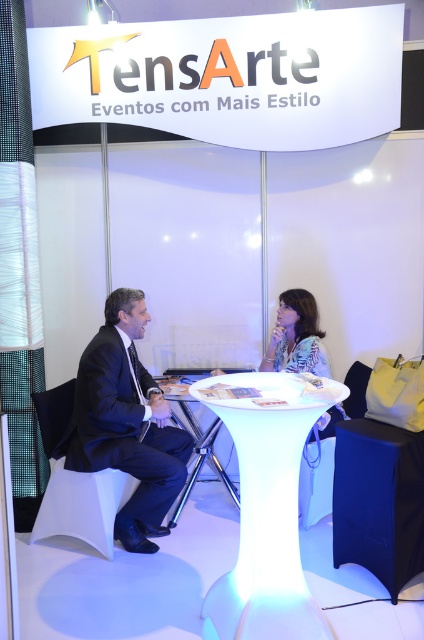
Measure the distance from white glossy table at center to printed fabric blouse at center.

white glossy table at center is 1.13 meters from printed fabric blouse at center.

Can you confirm if white glossy table at center is positioned below printed fabric blouse at center?

Yes.

Does point (267, 444) come farther from viewer compared to point (315, 365)?

No, it is in front of (315, 365).

Where is `white glossy table at center`? Image resolution: width=424 pixels, height=640 pixels. white glossy table at center is located at coordinates coord(265,515).

Does black suit at left have a greater width compared to printed fabric blouse at center?

Indeed, black suit at left has a greater width compared to printed fabric blouse at center.

Who is more forward, (175, 477) or (318, 365)?

Point (175, 477) is more forward.

The height and width of the screenshot is (640, 424). I want to click on black suit at left, so click(127, 422).

At what (x,y) coordinates should I click in order to perform the action: click on black suit at left. Please return your answer as a coordinate pair (x, y). The height and width of the screenshot is (640, 424). Looking at the image, I should click on (127, 422).

Is white glossy table at center to the left of black suit at left from the viewer's perspective?

Incorrect, white glossy table at center is not on the left side of black suit at left.

Describe the element at coordinates (265, 515) in the screenshot. I see `white glossy table at center` at that location.

Is point (214, 376) positioned behind point (130, 531)?

No, it is in front of (130, 531).

You are a GUI agent. You are given a task and a screenshot of the screen. Output one action in this format:
    pyautogui.click(x=<x>, y=<y>)
    Task: Click on the white glossy table at center
    
    Given the screenshot: What is the action you would take?
    pyautogui.click(x=265, y=515)